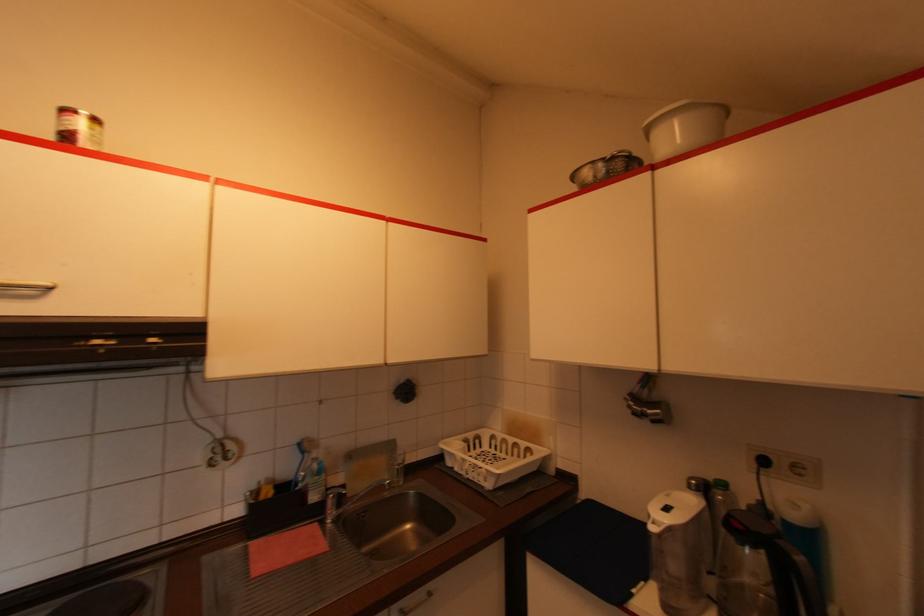
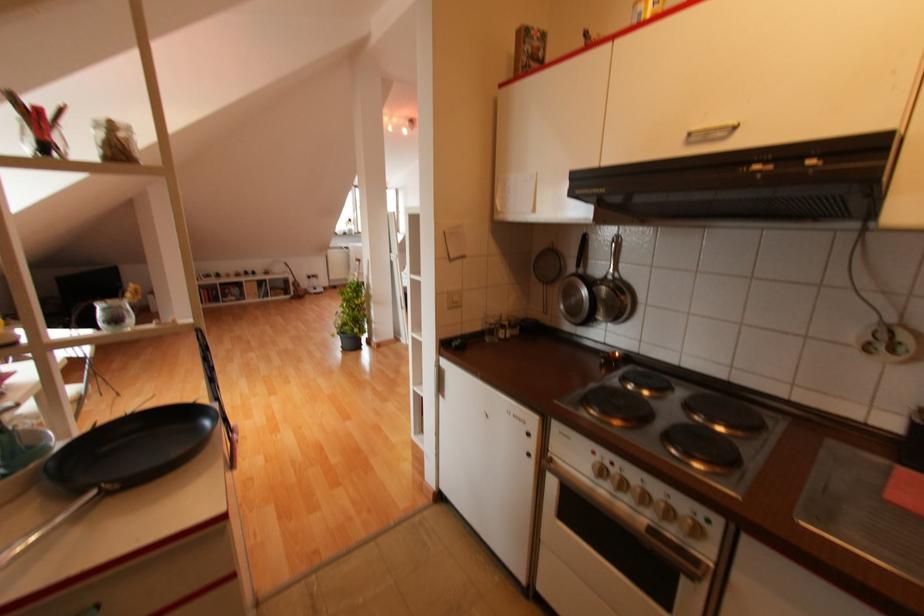
Based on the continuous images, in which direction is the camera rotating?

The camera rotated toward left-down.